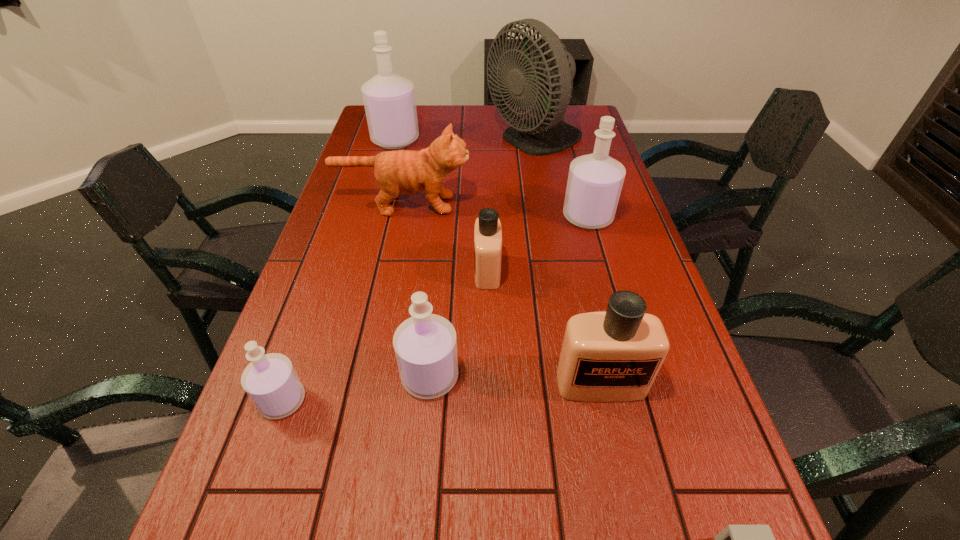
This screenshot has height=540, width=960. In order to click on object that is at the far right corner in this screenshot , I will do `click(541, 73)`.

In the image, there is a desktop. Identify the location of vacant space at the far edge. (470, 113).

In the image, there is a desktop. Identify the location of free region at the left edge. Image resolution: width=960 pixels, height=540 pixels. (285, 339).

Find the location of a particular element. Image resolution: width=960 pixels, height=540 pixels. vacant space at the right edge of the desktop is located at coordinates (719, 491).

The width and height of the screenshot is (960, 540). Find the location of `free space between the fan and the smallest purple perfume`. free space between the fan and the smallest purple perfume is located at coordinates coord(409,271).

Image resolution: width=960 pixels, height=540 pixels. What are the coordinates of `vacant space that's between the gray fan and the nearer beige perfume` in the screenshot? It's located at (567, 262).

Select which object appears as the seventh closest to the nearer beige perfume. Please provide its 2D coordinates. Your answer should be formatted as a tuple, i.e. [(x, y)], where the tuple contains the x and y coordinates of a point satisfying the conditions above.

[(541, 73)]

Identify which object is located as the seventh nearest to the tallest perfume. Please provide its 2D coordinates. Your answer should be formatted as a tuple, i.e. [(x, y)], where the tuple contains the x and y coordinates of a point satisfying the conditions above.

[(612, 356)]

The height and width of the screenshot is (540, 960). Identify the location of perfume that can be found as the second closest to the farthest purple perfume. (487, 231).

Identify which perfume is located as the nearest to the shortest object. Please provide its 2D coordinates. Your answer should be formatted as a tuple, i.e. [(x, y)], where the tuple contains the x and y coordinates of a point satisfying the conditions above.

[(612, 356)]